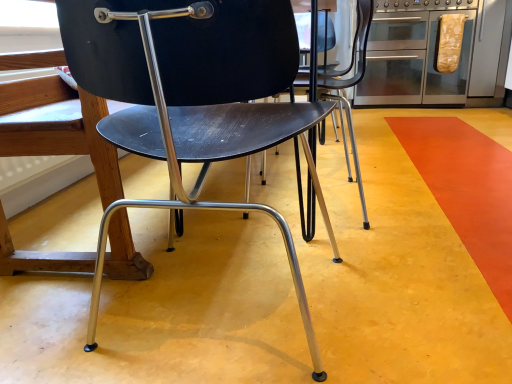
Image resolution: width=512 pixels, height=384 pixels. Describe the element at coordinates (193, 95) in the screenshot. I see `matte black chair at center` at that location.

The height and width of the screenshot is (384, 512). Find the location of `matte black chair at center`. matte black chair at center is located at coordinates (193, 95).

Describe the element at coordinates (413, 55) in the screenshot. This screenshot has height=384, width=512. I see `metallic stainless steel oven at upper right` at that location.

Find the location of a particular element. metallic stainless steel oven at upper right is located at coordinates (413, 55).

This screenshot has width=512, height=384. I want to click on matte black chair at center, so click(193, 95).

Which object is positioned more to the left, matte black chair at center or metallic stainless steel oven at upper right?

matte black chair at center.

Is matte black chair at center behind metallic stainless steel oven at upper right?

No, matte black chair at center is closer to the viewer.

Is point (246, 141) positioned after point (369, 51)?

No, (246, 141) is in front of (369, 51).

From the image's perspective, which is below, matte black chair at center or metallic stainless steel oven at upper right?

matte black chair at center.

Looking at this image, from a real-world perspective, which object rests below the other?

matte black chair at center.

Can you confirm if matte black chair at center is thinner than metallic stainless steel oven at upper right?

Correct, the width of matte black chair at center is less than that of metallic stainless steel oven at upper right.

Which of these two, matte black chair at center or metallic stainless steel oven at upper right, stands shorter?

matte black chair at center.

In the scene shown: Who is smaller, matte black chair at center or metallic stainless steel oven at upper right?

matte black chair at center is smaller.

Can we say matte black chair at center lies outside metallic stainless steel oven at upper right?

Absolutely, matte black chair at center is external to metallic stainless steel oven at upper right.

Are matte black chair at center and metallic stainless steel oven at upper right far apart?

Yes, matte black chair at center is far from metallic stainless steel oven at upper right.

Consider the image. Is matte black chair at center looking in the opposite direction of metallic stainless steel oven at upper right?

matte black chair at center does not have its back to metallic stainless steel oven at upper right.

How many degrees apart are the facing directions of matte black chair at center and metallic stainless steel oven at upper right?

They differ by 180 degrees in their facing directions.

How distant is matte black chair at center from metallic stainless steel oven at upper right?

9.27 feet.

At what (x,y) coordinates should I click in order to perform the action: click on oven above the matte black chair at center (from a real-world perspective). Please return your answer as a coordinate pair (x, y). The height and width of the screenshot is (384, 512). Looking at the image, I should click on (413, 55).

In the image, is metallic stainless steel oven at upper right on the left side or the right side of matte black chair at center?

Clearly, metallic stainless steel oven at upper right is on the right of matte black chair at center in the image.

Which is behind, metallic stainless steel oven at upper right or matte black chair at center?

metallic stainless steel oven at upper right is further away from the camera.

Is point (440, 77) farther from camera compared to point (148, 15)?

Yes, it is.

From the image's perspective, is metallic stainless steel oven at upper right over matte black chair at center?

Correct, metallic stainless steel oven at upper right appears higher than matte black chair at center in the image.

From a real-world perspective, is metallic stainless steel oven at upper right beneath matte black chair at center?

Incorrect, from a real-world perspective, metallic stainless steel oven at upper right is higher than matte black chair at center.

Consider the image. Looking at their sizes, would you say metallic stainless steel oven at upper right is wider or thinner than matte black chair at center?

In the image, metallic stainless steel oven at upper right appears to be wider than matte black chair at center.

Considering the relative sizes of metallic stainless steel oven at upper right and matte black chair at center in the image provided, is metallic stainless steel oven at upper right shorter than matte black chair at center?

In fact, metallic stainless steel oven at upper right may be taller than matte black chair at center.

Does metallic stainless steel oven at upper right have a larger size compared to matte black chair at center?

Correct, metallic stainless steel oven at upper right is larger in size than matte black chair at center.

Is metallic stainless steel oven at upper right completely or partially outside of matte black chair at center?

metallic stainless steel oven at upper right lies outside matte black chair at center's area.

Are metallic stainless steel oven at upper right and matte black chair at center making contact?

No, metallic stainless steel oven at upper right is not in contact with matte black chair at center.

Could you tell me if metallic stainless steel oven at upper right is facing matte black chair at center?

Yes, metallic stainless steel oven at upper right is oriented towards matte black chair at center.

Locate an element on the screen. The image size is (512, 384). chair below the metallic stainless steel oven at upper right (from the image's perspective) is located at coordinates (193, 95).

Identify the location of oven above the matte black chair at center (from the image's perspective). This screenshot has height=384, width=512. (413, 55).

Locate an element on the screen. This screenshot has width=512, height=384. chair below the metallic stainless steel oven at upper right (from a real-world perspective) is located at coordinates (193, 95).